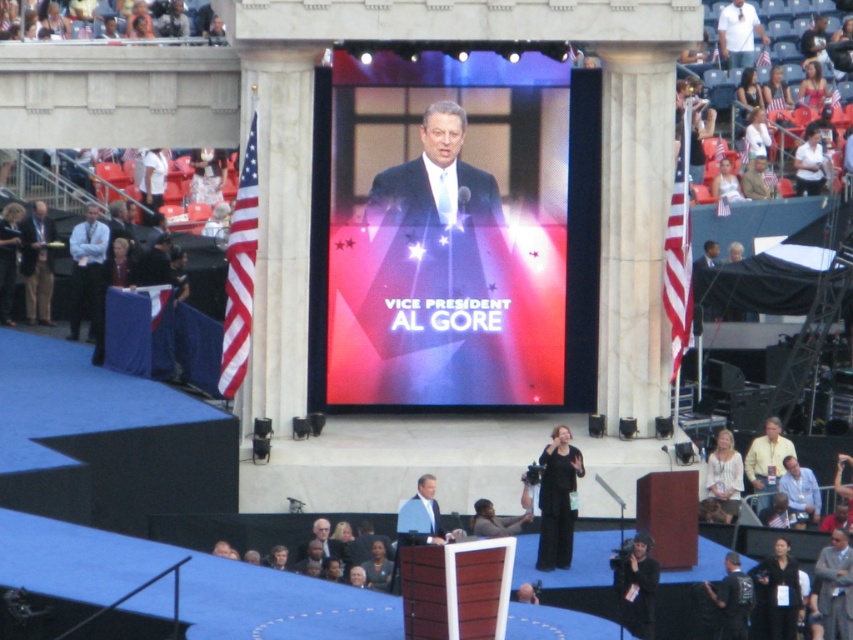
Between matte blue shirt at left and blue fabric at center, which one appears on the right side from the viewer's perspective?

blue fabric at center is more to the right.

Which is behind, point (74, 321) or point (440, 540)?

The point (74, 321) is more distant.

This screenshot has width=853, height=640. Identify the location of matte blue shirt at left. (86, 269).

Identify the location of matte blue shirt at left. (86, 269).

Locate an element on the screen. shiny blue fabric at center is located at coordinates (x=444, y=250).

Does shiny blue fabric at center appear on the right side of light brown hair at lower center?

Yes, shiny blue fabric at center is to the right of light brown hair at lower center.

This screenshot has width=853, height=640. I want to click on shiny blue fabric at center, so click(444, 250).

Identify the location of shiny blue fabric at center. (444, 250).

Find the location of a particular element. The height and width of the screenshot is (640, 853). shiny blue fabric at center is located at coordinates (444, 250).